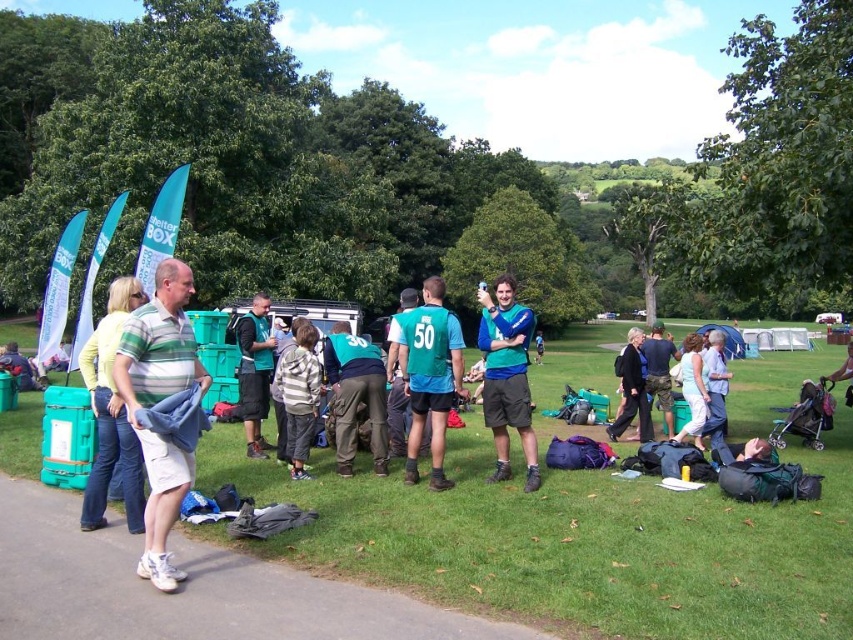
Question: Can you confirm if striped hoodie at center is thinner than camouflage pants at center?

Choices:
 (A) no
 (B) yes

Answer: (B)

Question: Which object is positioned farthest from the camouflage pants at center?

Choices:
 (A) teal fabric jacket at center
 (B) black fabric jacket at center

Answer: (A)

Question: Which point is farther from the camera taking this photo?

Choices:
 (A) (479, 332)
 (B) (102, 356)

Answer: (A)

Question: Is striped hoodie at center below light blue shirt at center?

Choices:
 (A) no
 (B) yes

Answer: (A)

Question: Which is farther from the striped hoodie at center?

Choices:
 (A) light blue denim shorts at center
 (B) yellow-green sweater at left
 (C) blue matte shirt at center
 (D) light blue shirt at center

Answer: (D)

Question: Is the position of dark green jersey at center less distant than that of light blue shirt at center?

Choices:
 (A) yes
 (B) no

Answer: (B)